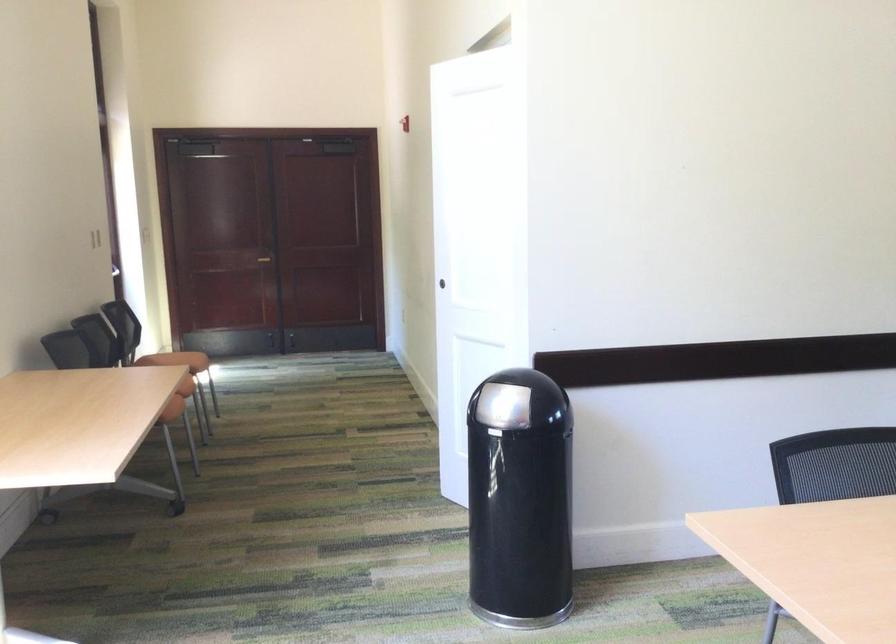
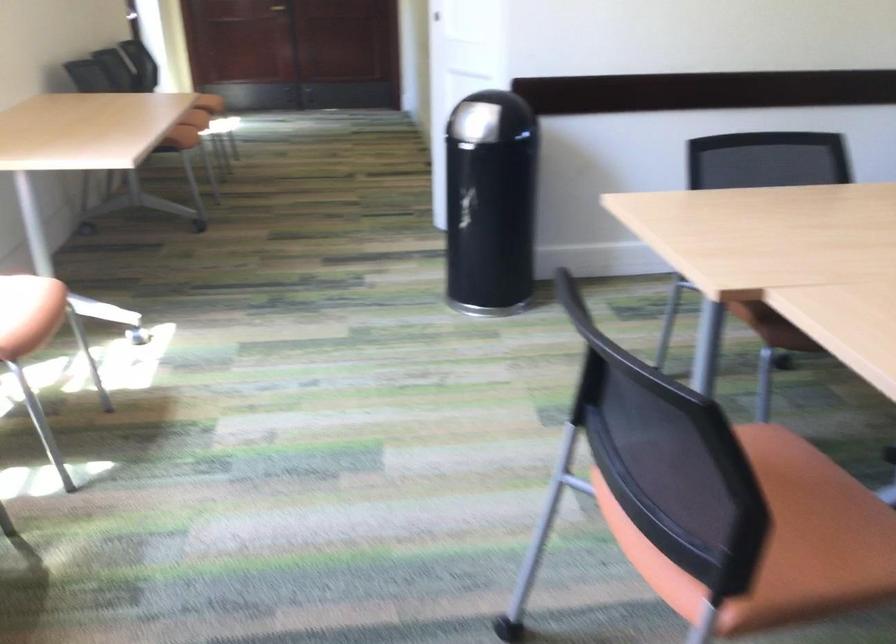
Where in the second image is the point corresponding to [176,393] from the first image?

(192, 124)